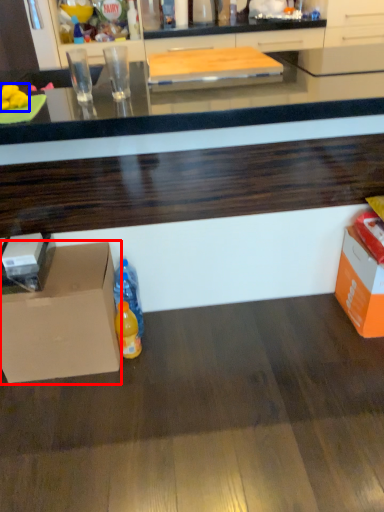
Question: Which object is further to the camera taking this photo, cardboard box (highlighted by a red box) or food (highlighted by a blue box)?

Choices:
 (A) cardboard box
 (B) food

Answer: (A)